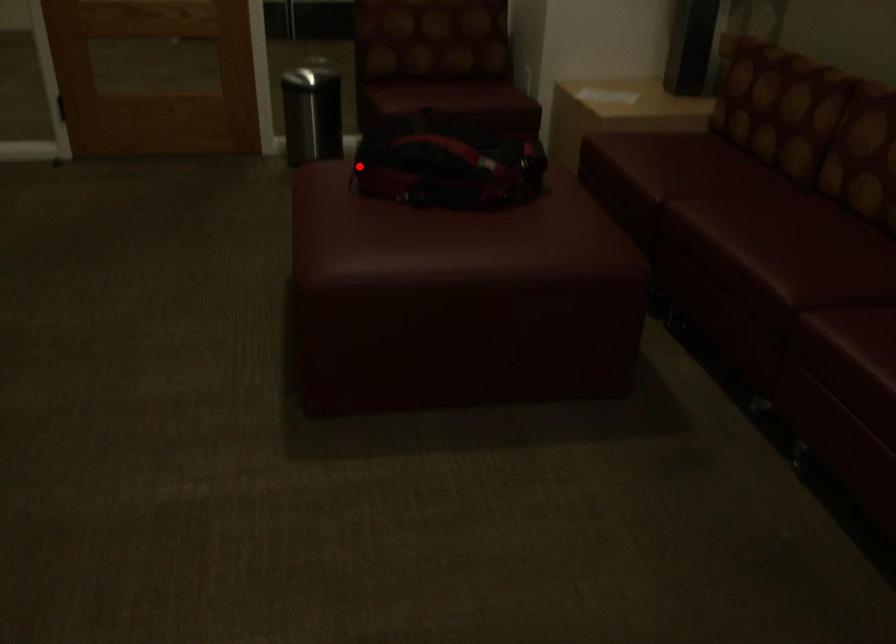
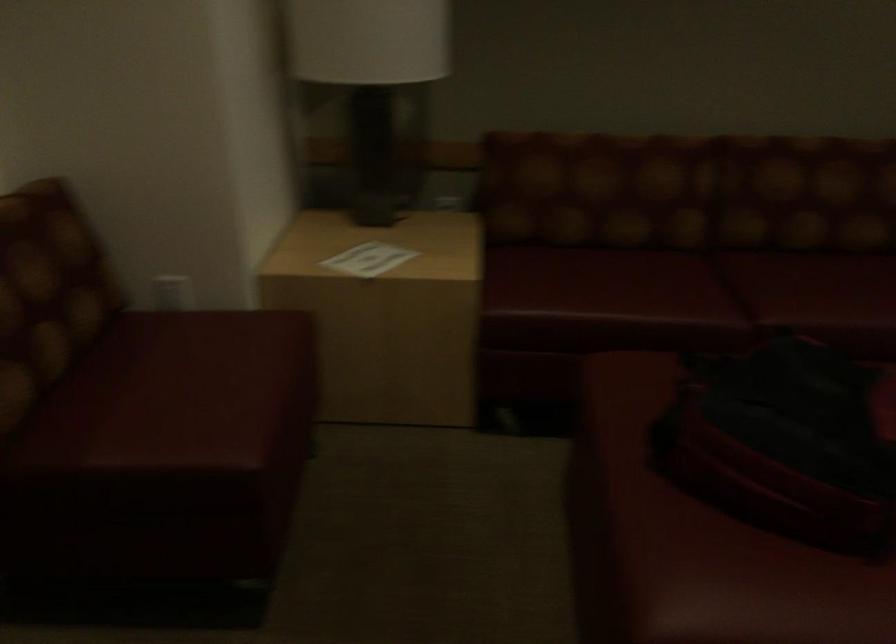
Where in the second image is the point corresponding to the highlighted location from the first image?

(693, 541)